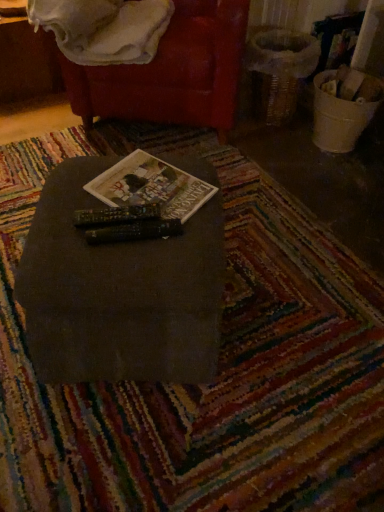
Question: Considering the relative sizes of matte black table at center and white soft blanket at upper left in the image provided, is matte black table at center bigger than white soft blanket at upper left?

Choices:
 (A) yes
 (B) no

Answer: (A)

Question: Is matte black table at center taller than white soft blanket at upper left?

Choices:
 (A) no
 (B) yes

Answer: (B)

Question: From a real-world perspective, is matte black table at center positioned under white soft blanket at upper left based on gravity?

Choices:
 (A) no
 (B) yes

Answer: (B)

Question: Is the position of matte black table at center less distant than that of white soft blanket at upper left?

Choices:
 (A) no
 (B) yes

Answer: (B)

Question: Does matte black table at center have a lesser width compared to white soft blanket at upper left?

Choices:
 (A) no
 (B) yes

Answer: (B)

Question: In the image, is matte black table at center positioned in front of or behind hardcover book at center?

Choices:
 (A) behind
 (B) front

Answer: (B)

Question: Is matte black table at center wider or thinner than hardcover book at center?

Choices:
 (A) thin
 (B) wide

Answer: (B)

Question: From the image's perspective, relative to hardcover book at center, is matte black table at center above or below?

Choices:
 (A) above
 (B) below

Answer: (B)

Question: Considering the positions of matte black table at center and hardcover book at center in the image, is matte black table at center bigger or smaller than hardcover book at center?

Choices:
 (A) small
 (B) big

Answer: (B)

Question: From a real-world perspective, is white soft blanket at upper left physically located above or below matte black table at center?

Choices:
 (A) below
 (B) above

Answer: (B)

Question: Considering the relative positions of white soft blanket at upper left and matte black table at center in the image provided, is white soft blanket at upper left to the left or to the right of matte black table at center?

Choices:
 (A) right
 (B) left

Answer: (B)

Question: Is white soft blanket at upper left in front of or behind matte black table at center in the image?

Choices:
 (A) front
 (B) behind

Answer: (B)

Question: From the image's perspective, relative to matte black table at center, is white soft blanket at upper left above or below?

Choices:
 (A) above
 (B) below

Answer: (A)

Question: Would you say hardcover book at center is to the left or to the right of matte black table at center in the picture?

Choices:
 (A) right
 (B) left

Answer: (A)

Question: Is point (198, 193) closer or farther from the camera than point (196, 271)?

Choices:
 (A) farther
 (B) closer

Answer: (A)